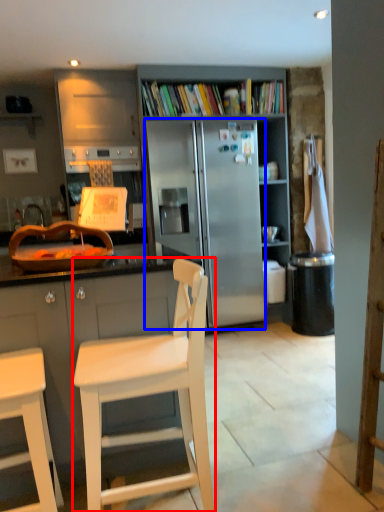
Question: Which object is further to the camera taking this photo, chair (highlighted by a red box) or refrigerator (highlighted by a blue box)?

Choices:
 (A) chair
 (B) refrigerator

Answer: (B)